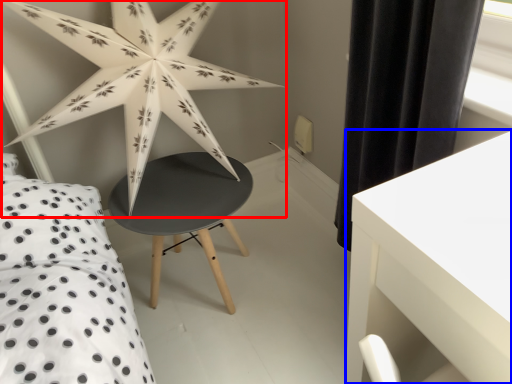
Question: Which point is closer to the camera, star (highlighted by a red box) or table (highlighted by a blue box)?

Choices:
 (A) star
 (B) table

Answer: (B)